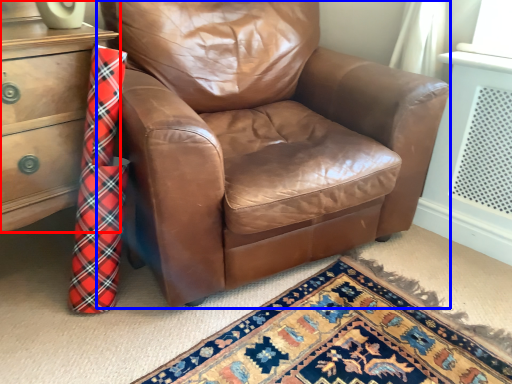
Question: Which object appears closest to the camera in this image, chest of drawers (highlighted by a red box) or chair (highlighted by a blue box)?

Choices:
 (A) chest of drawers
 (B) chair

Answer: (B)